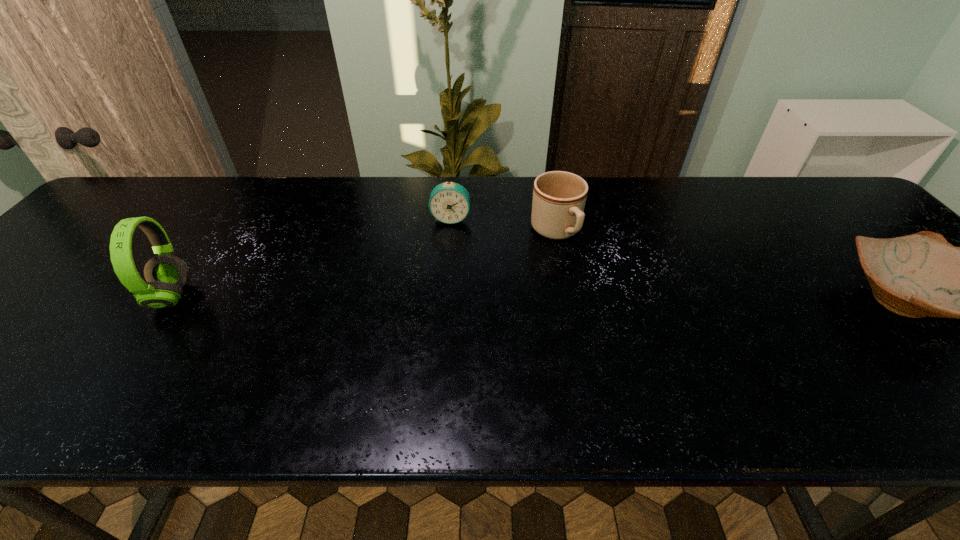
Where is `vacant space on the desktop that is between the leftmost object and the rightmost object and is positioned on the side of the second object from right to left with the handle`? The width and height of the screenshot is (960, 540). vacant space on the desktop that is between the leftmost object and the rightmost object and is positioned on the side of the second object from right to left with the handle is located at coordinates (610, 301).

Locate an element on the screen. This screenshot has height=540, width=960. vacant space on the desktop that is between the tallest object and the rightmost object and is positioned on the front-facing side of the alarm clock is located at coordinates point(439,299).